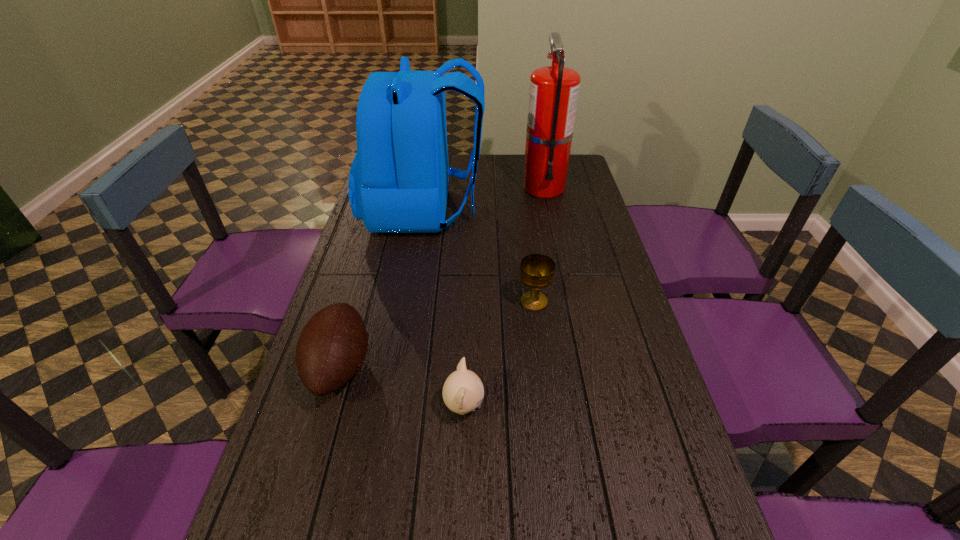
The image size is (960, 540). I want to click on fire extinguisher, so click(x=553, y=96).

At what (x,y) coordinates should I click in order to perform the action: click on backpack. Please return your answer as a coordinate pair (x, y). The height and width of the screenshot is (540, 960). Looking at the image, I should click on (398, 182).

Where is `football`? football is located at coordinates (332, 347).

Find the location of `chalice`. chalice is located at coordinates (537, 271).

Locate an element on the screen. kitten is located at coordinates (463, 391).

Identify the location of vacant space located 0.220m at the nozzle of the fire extinguisher. The image size is (960, 540). (554, 238).

At what (x,y) coordinates should I click in order to perform the action: click on vacant space located on the back of the backpack. Please return your answer as a coordinate pair (x, y). This screenshot has height=540, width=960. Looking at the image, I should click on (527, 209).

At what (x,y) coordinates should I click in order to perform the action: click on vacant space located on the laces of the football. Please return your answer as a coordinate pair (x, y). The height and width of the screenshot is (540, 960). Looking at the image, I should click on (462, 366).

Locate an element on the screen. This screenshot has height=540, width=960. free space located on the left of the chalice is located at coordinates (388, 302).

The image size is (960, 540). I want to click on blank space located 0.100m on the face of the kitten, so click(527, 407).